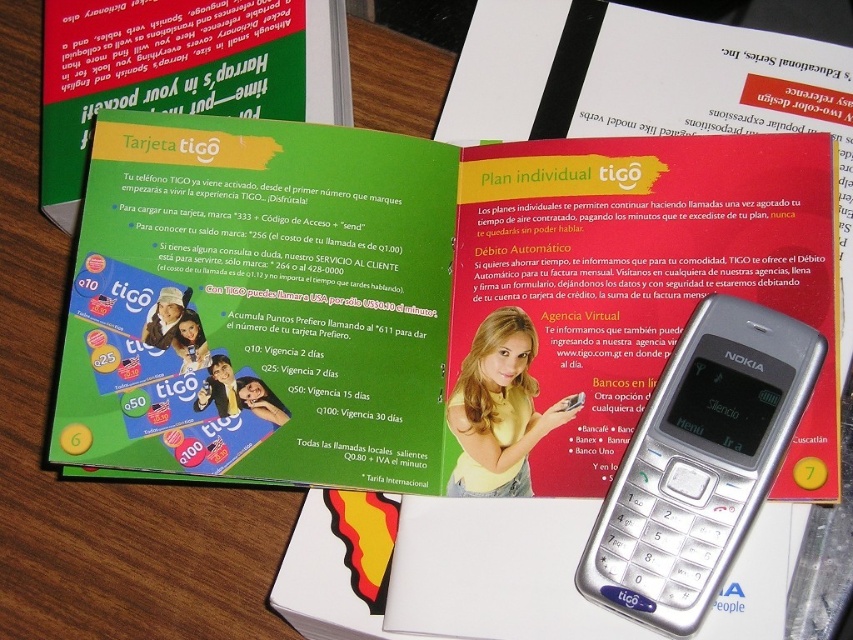
Does silver metallic nokia phone at center-right have a lesser height compared to green matte card at upper left?

In fact, silver metallic nokia phone at center-right may be taller than green matte card at upper left.

Does point (751, 308) come in front of point (236, 106)?

Yes.

Measure the distance between silver metallic nokia phone at center-right and camera.

A distance of 1.02 meters exists between silver metallic nokia phone at center-right and camera.

Locate an element on the screen. The image size is (853, 640). silver metallic nokia phone at center-right is located at coordinates (699, 464).

Can you confirm if matte plastic booklet at center is positioned to the right of green matte card at upper left?

Correct, you'll find matte plastic booklet at center to the right of green matte card at upper left.

Does matte plastic booklet at center appear under green matte card at upper left?

Correct, matte plastic booklet at center is located below green matte card at upper left.

Is point (534, 204) positioned in front of point (196, 100)?

Yes, point (534, 204) is closer to viewer.

Identify the location of matte plastic booklet at center. The image size is (853, 640). (659, 204).

Where is `green matte card at center`? green matte card at center is located at coordinates (416, 294).

Does green matte card at center have a greater height compared to green matte card at upper left?

Yes, green matte card at center is taller than green matte card at upper left.

Is point (236, 365) positioned before point (39, 195)?

That is True.

Find the location of a particular element. green matte card at center is located at coordinates (416, 294).